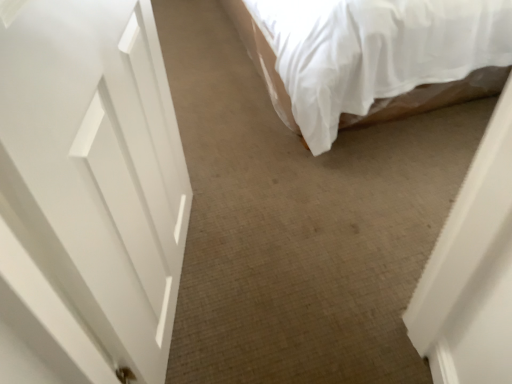
Question: Is point (138, 339) positioned closer to the camera than point (271, 24)?

Choices:
 (A) farther
 (B) closer

Answer: (B)

Question: Visually, is white glossy door at left positioned to the left or to the right of white fabric bed at upper right?

Choices:
 (A) right
 (B) left

Answer: (B)

Question: Is white glossy door at left wider or thinner than white fabric bed at upper right?

Choices:
 (A) wide
 (B) thin

Answer: (B)

Question: From a real-world perspective, is white fabric bed at upper right positioned above or below white glossy door at left?

Choices:
 (A) below
 (B) above

Answer: (A)

Question: From the image's perspective, is white fabric bed at upper right located above or below white glossy door at left?

Choices:
 (A) above
 (B) below

Answer: (A)

Question: In terms of width, does white fabric bed at upper right look wider or thinner when compared to white glossy door at left?

Choices:
 (A) wide
 (B) thin

Answer: (A)

Question: Based on their positions, is white fabric bed at upper right located to the left or right of white glossy door at left?

Choices:
 (A) left
 (B) right

Answer: (B)